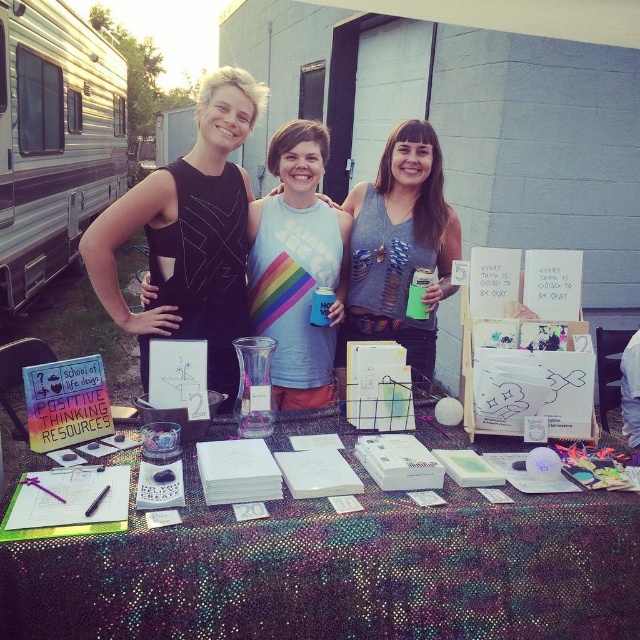
You are organizing a community event and need to ensure that all promotional materials are visible to attendees. Given the setup described, will the white paper at center be visible over the grayholey tank top at center?

The white paper at center is shorter than the grayholey tank top at center, so it will not be visible over the grayholey tank top at center.

You are organizing a community event and need to place a name tag on the table. The name tag is 10 cm wide. There is a white paper at center and a grayholey tank top at center on the table. Can the name tag fit between them?

The white paper at center is to the left of the grayholey tank top at center. The distance between them is not specified, so it is uncertain if the name tag will fit. More information is needed.

You are a visitor at this event and want to pick up the white paper at center and the silver metallic recreational vehicle at left. Which object should you reach for first to grab both efficiently?

You should reach for the white paper at center first because it is closer to you than the silver metallic recreational vehicle at left, allowing you to efficiently grab both items without needing to adjust your position significantly.